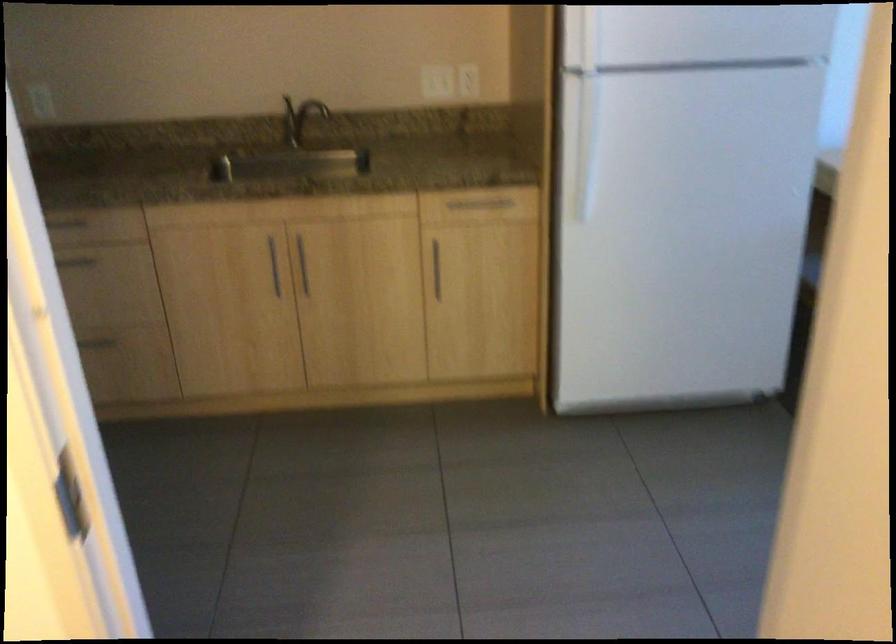
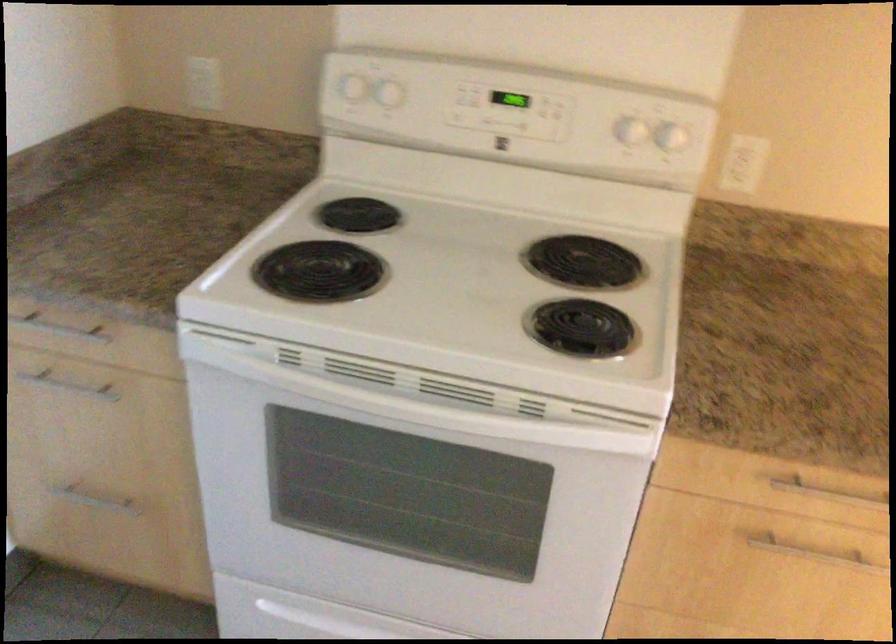
In a continuous first-person perspective shot, in which direction is the camera moving?

The movement direction of the cameraman is left, forward.